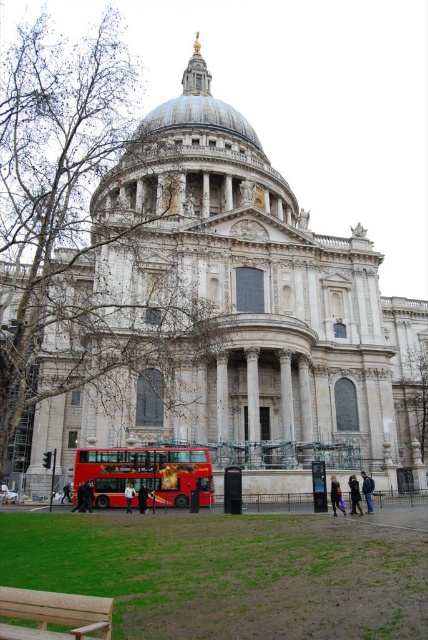
What do you see at coordinates (235, 312) in the screenshot?
I see `white stone cathedral at center` at bounding box center [235, 312].

Can you confirm if white stone cathedral at center is positioned to the left of dark blue jacket at lower center?

Yes, white stone cathedral at center is to the left of dark blue jacket at lower center.

Is point (195, 65) positioned behind point (356, 492)?

That is True.

Where is `white stone cathedral at center`? This screenshot has width=428, height=640. white stone cathedral at center is located at coordinates (235, 312).

Is dark blue jacket at lower center bigger than dark blue jacket at center?

Actually, dark blue jacket at lower center might be smaller than dark blue jacket at center.

Is point (356, 492) behind point (127, 490)?

No, it is not.

Which is behind, point (350, 492) or point (130, 502)?

Positioned behind is point (130, 502).

Locate an element on the screen. The height and width of the screenshot is (640, 428). dark blue jacket at lower center is located at coordinates (354, 496).

Is point (290, 598) positioned before point (339, 492)?

Yes, it is in front of point (339, 492).

Find the location of a particular element. This screenshot has height=640, width=428. green grass at lower left is located at coordinates (228, 573).